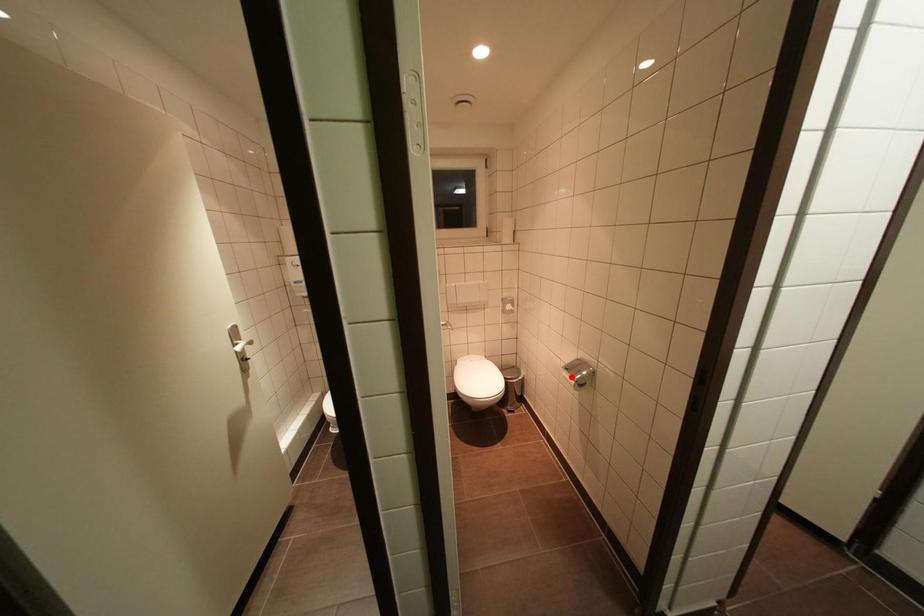
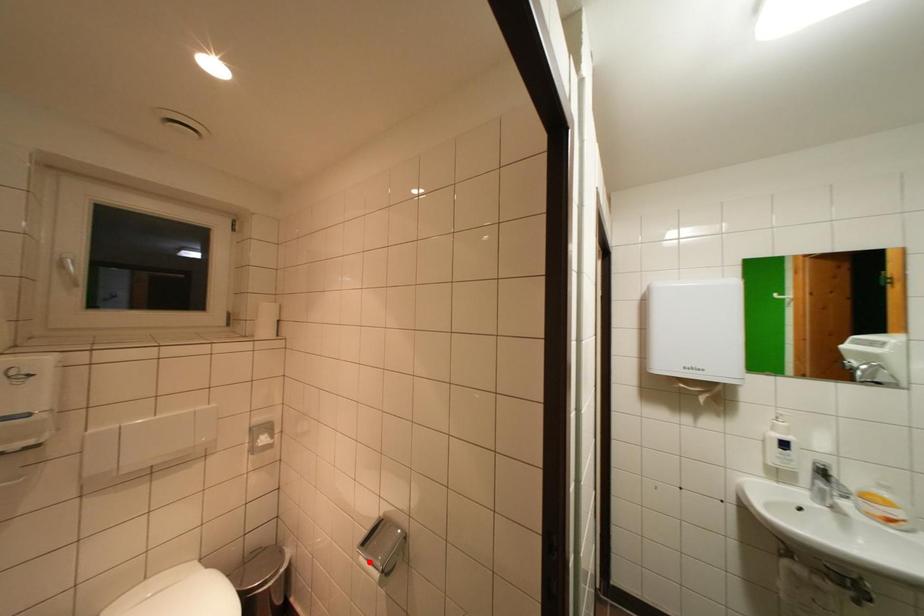
I am providing you with two images of the same scene from different viewpoints. A red point is marked on the first image and another point is marked on the second image. Is the red point in image1 aligned with the point shown in image2?

Yes